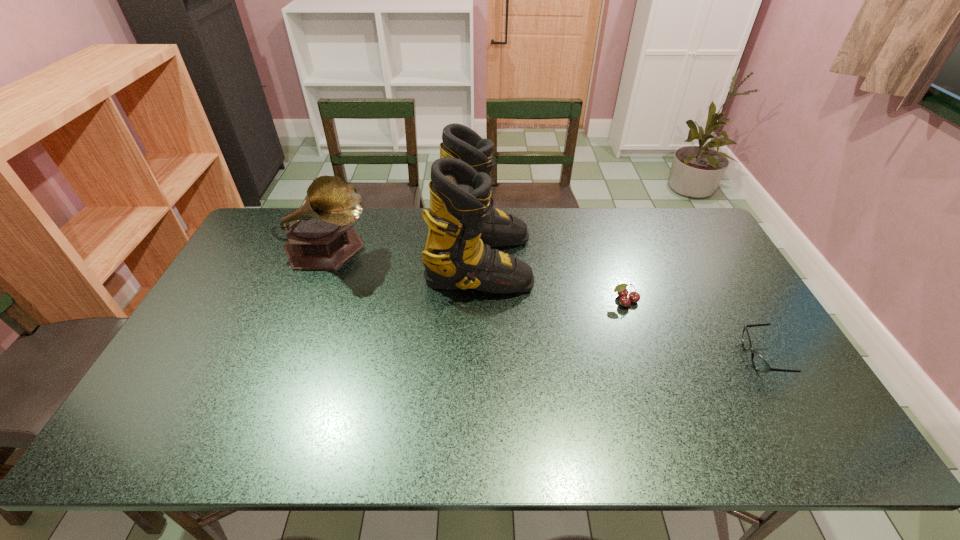
The height and width of the screenshot is (540, 960). Identify the location of free space located on the leaves of the second object from right to left. (640, 348).

Where is `vacant space located on the front-facing side of the spectacles`? The height and width of the screenshot is (540, 960). vacant space located on the front-facing side of the spectacles is located at coordinates (628, 357).

Where is `vacant space situated 0.310m on the front-facing side of the spectacles`? This screenshot has height=540, width=960. vacant space situated 0.310m on the front-facing side of the spectacles is located at coordinates pos(628,357).

Identify the location of vacant space located on the front-facing side of the spectacles. This screenshot has height=540, width=960. (610, 357).

Image resolution: width=960 pixels, height=540 pixels. I want to click on ski boots present at the far edge, so click(x=462, y=224).

Locate an element on the screen. The width and height of the screenshot is (960, 540). phonograph record located in the far edge section of the desktop is located at coordinates (320, 234).

In order to click on object positioned at the left edge in this screenshot , I will do `click(320, 234)`.

The width and height of the screenshot is (960, 540). Find the location of `object located at the right edge`. object located at the right edge is located at coordinates (759, 363).

The image size is (960, 540). What are the coordinates of `object located in the far left corner section of the desktop` in the screenshot? It's located at (320, 234).

This screenshot has height=540, width=960. In order to click on vacant space at the far edge of the desktop in this screenshot , I will do `click(615, 242)`.